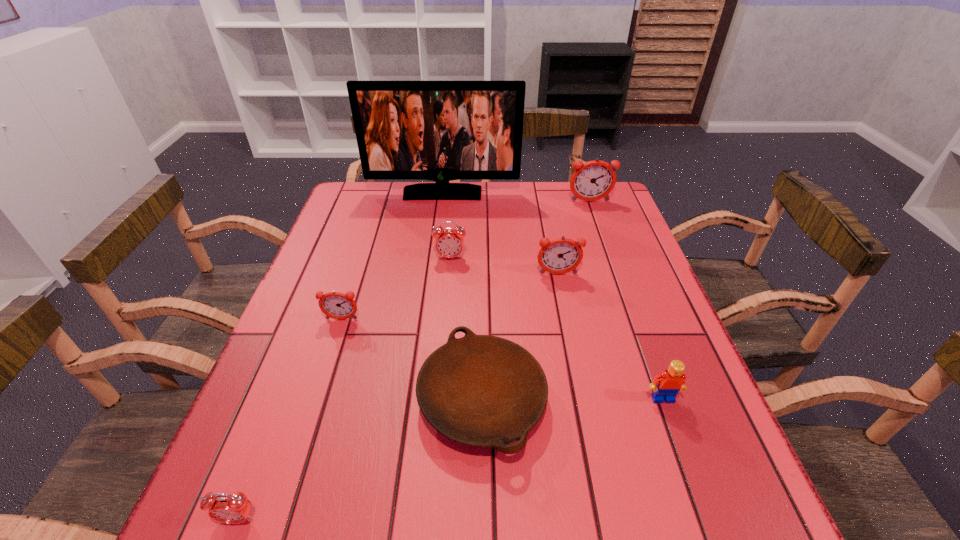
Where is `free space between the Lego and the nearest object`? This screenshot has height=540, width=960. free space between the Lego and the nearest object is located at coordinates (450, 459).

Find the location of a particular element. This screenshot has width=960, height=540. unoccupied position between the seventh shortest object and the second farthest reddish-pink alarm clock is located at coordinates (574, 238).

At what (x,y) coordinates should I click in order to perform the action: click on free space between the monitor and the second reddish-pink alarm clock from left to right. Please return your answer as a coordinate pair (x, y). Looking at the image, I should click on (500, 234).

Locate an element on the screen. free space between the red Lego and the second reddish-pink alarm clock from left to right is located at coordinates (611, 336).

The image size is (960, 540). What are the coordinates of `object that is the fifth closest to the third object from right to left` in the screenshot? It's located at (671, 381).

This screenshot has height=540, width=960. I want to click on object that is the fourth closest to the third farthest object, so click(x=485, y=391).

I want to click on the closest alarm clock to the shortest object, so click(336, 305).

Select which alarm clock is the fourth closest to the plate. Please provide its 2D coordinates. Your answer should be formatted as a tuple, i.e. [(x, y)], where the tuple contains the x and y coordinates of a point satisfying the conditions above.

[(449, 243)]

Identify the location of the closest reddish-pink alarm clock to the right red alarm clock. The image size is (960, 540). (559, 256).

Identify which reddish-pink alarm clock is located as the nearest to the second reddish-pink alarm clock from left to right. Please provide its 2D coordinates. Your answer should be formatted as a tuple, i.e. [(x, y)], where the tuple contains the x and y coordinates of a point satisfying the conditions above.

[(593, 180)]